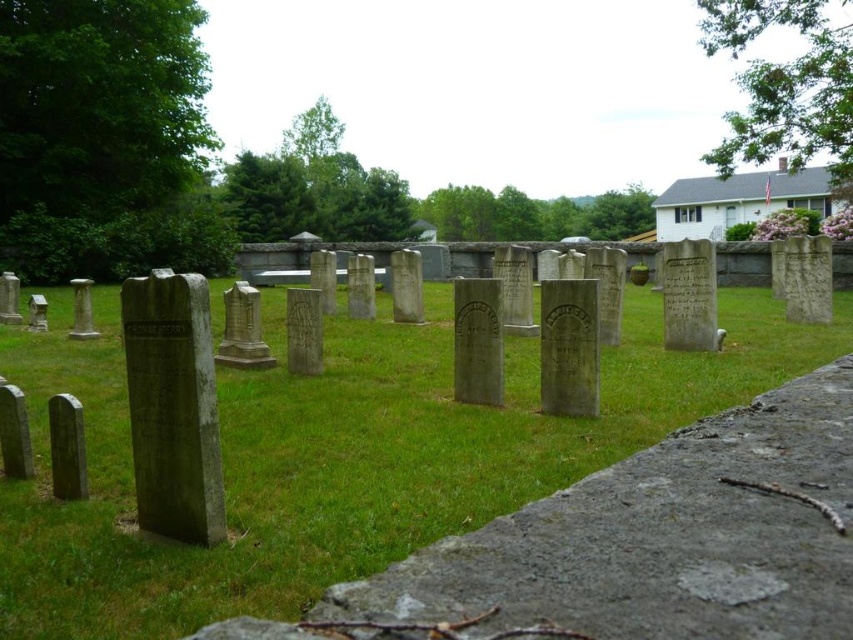
You are standing in the cemetery and want to place a small bouquet of flowers on the green grass at center. However, you notice the smooth gray stone gravestone at left. Where should you place the bouquet so it doesn not get in the way of the gravestone?

The green grass at center is positioned under the smooth gray stone gravestone at left, so placing the bouquet on the green grass at center would be directly beneath the gravestone. To avoid blocking the gravestone, you should place the bouquet on the grass area that is not under the gravestone, perhaps to the side or behind it.